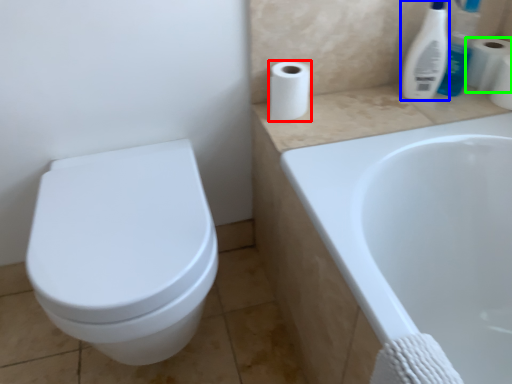
Question: Which object is the closest to the toilet paper (highlighted by a red box)? Choose among these: cleaning product (highlighted by a blue box) or toilet paper (highlighted by a green box).

Choices:
 (A) cleaning product
 (B) toilet paper

Answer: (A)